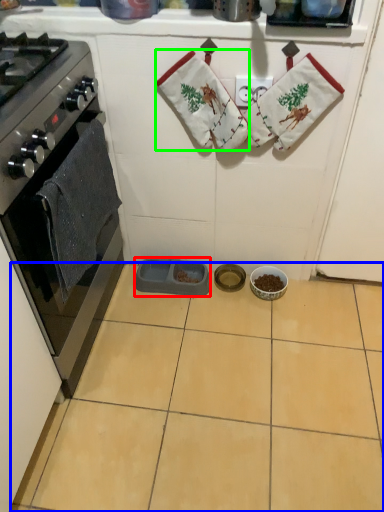
Question: Considering the real-world distances, which object is closest to appliance (highlighted by a red box)? ceramic tile (highlighted by a blue box) or hand towel (highlighted by a green box).

Choices:
 (A) ceramic tile
 (B) hand towel

Answer: (A)